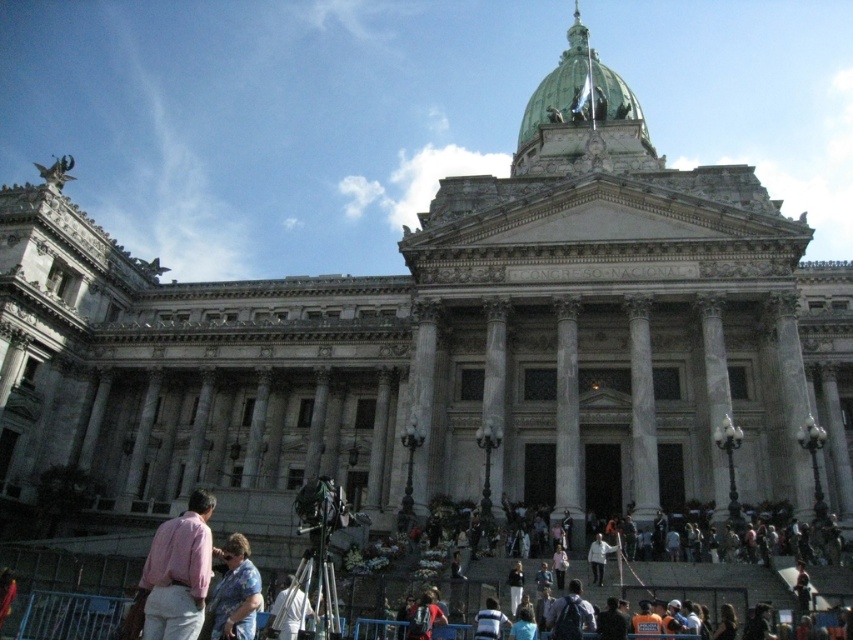
Question: Among these points, which one is nearest to the camera?

Choices:
 (A) (169, 534)
 (B) (227, 548)
 (C) (537, 93)
 (D) (296, 625)

Answer: (A)

Question: Which point appears farthest from the camera in this image?

Choices:
 (A) (592, 570)
 (B) (546, 74)

Answer: (B)

Question: Does green polished dome at upper center have a lesser width compared to pink cotton shirt at lower left?

Choices:
 (A) yes
 (B) no

Answer: (B)

Question: Which point is closer to the camera?

Choices:
 (A) green polished dome at upper center
 (B) white fabric at lower center
 (C) white fabric shirt at lower center
 (D) floral shirt at lower center

Answer: (D)

Question: Is pink cotton shirt at lower left closer to camera compared to white fabric at lower center?

Choices:
 (A) yes
 (B) no

Answer: (A)

Question: Is green polished dome at upper center to the left of white fabric at lower center from the viewer's perspective?

Choices:
 (A) yes
 (B) no

Answer: (B)